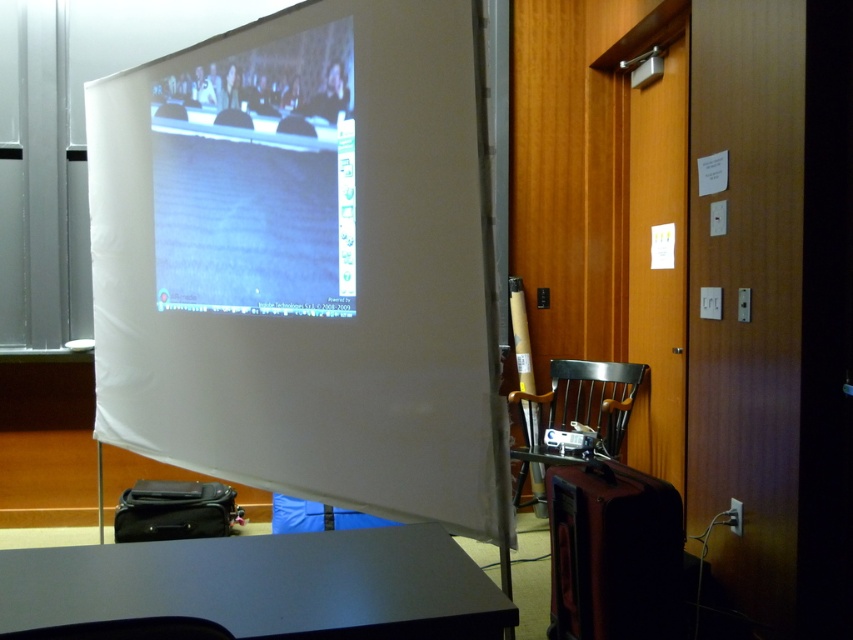
Image resolution: width=853 pixels, height=640 pixels. In order to click on white matte projection screen at center in this screenshot , I will do click(306, 262).

Does point (111, 310) lie behind point (538, 472)?

No.

Find the location of a particular element. The image size is (853, 640). white matte projection screen at center is located at coordinates (306, 262).

Locate an element on the screen. white matte projection screen at center is located at coordinates (306, 262).

How far apart are matte black table at lower center and wooden chair at lower right?

matte black table at lower center and wooden chair at lower right are 2.53 meters apart.

Who is lower down, matte black table at lower center or wooden chair at lower right?

Positioned lower is wooden chair at lower right.

The image size is (853, 640). Find the location of `matte black table at lower center`. matte black table at lower center is located at coordinates (265, 586).

Where is `matte black table at lower center`? The width and height of the screenshot is (853, 640). matte black table at lower center is located at coordinates (265, 586).

Does wooden chair at lower right come behind black plastic projector at center?

That is False.

Identify the location of wooden chair at lower right. This screenshot has height=640, width=853. (573, 410).